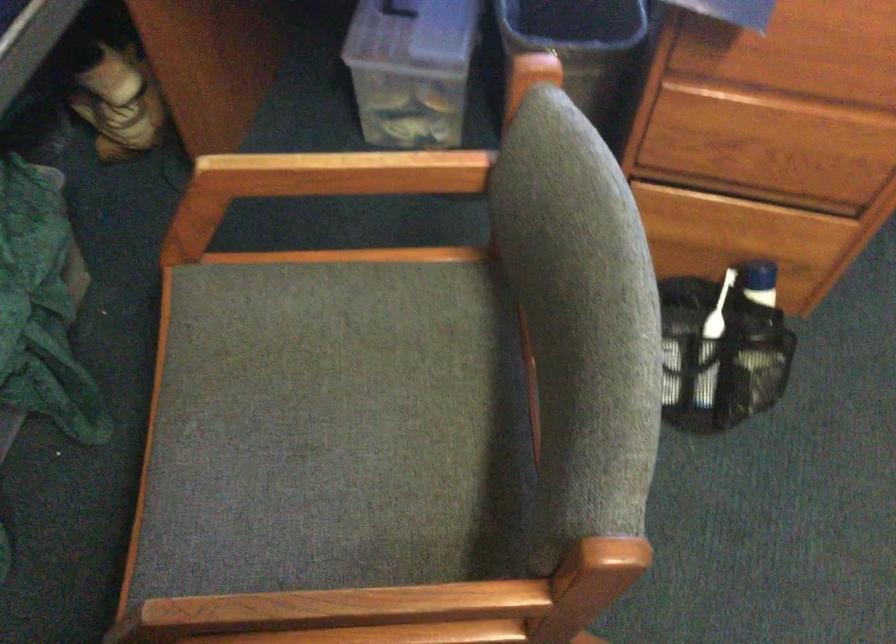
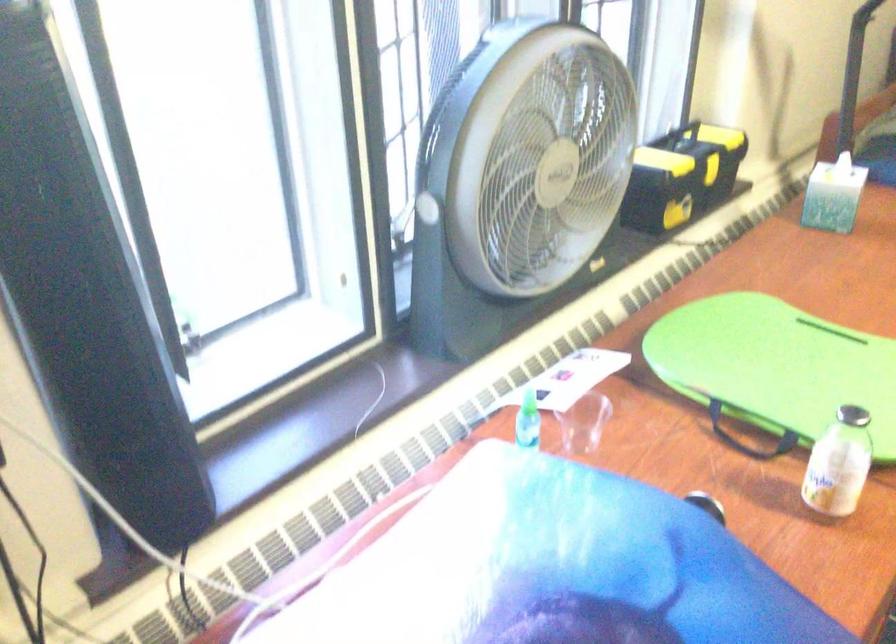
Question: Based on the continuous images, in which direction is the camera rotating? Reply with the corresponding letter.

Choices:
 (A) Left
 (B) Right
 (C) Up
 (D) Down

Answer: (B)